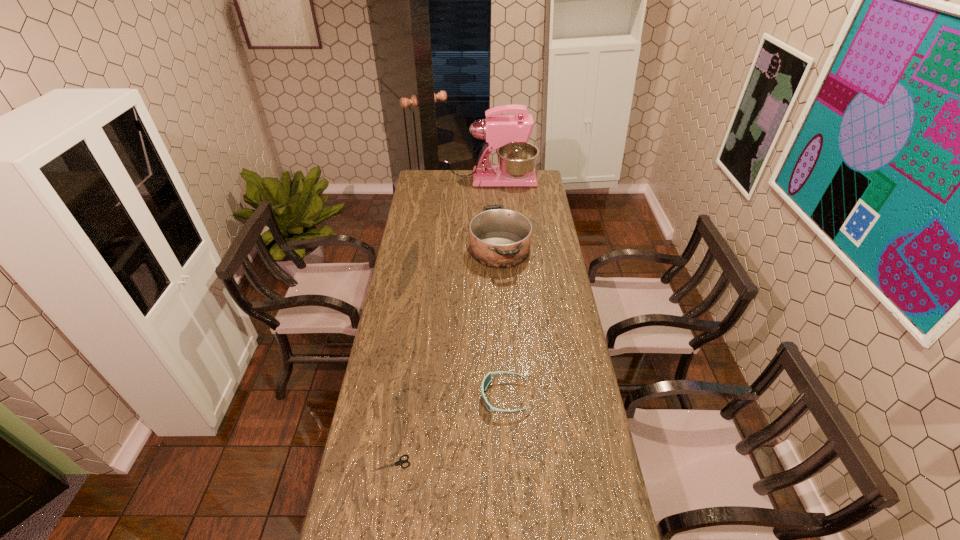
Identify the location of mixer. This screenshot has width=960, height=540. (507, 134).

At what (x,y) coordinates should I click in order to perform the action: click on the tallest object. Please return your answer as a coordinate pair (x, y). This screenshot has width=960, height=540. Looking at the image, I should click on (507, 134).

Where is `saucepan`? saucepan is located at coordinates (500, 238).

Where is `the second farthest object`? Image resolution: width=960 pixels, height=540 pixels. the second farthest object is located at coordinates (500, 238).

Identify the location of the third farthest object. (487, 379).

This screenshot has height=540, width=960. I want to click on the third tallest object, so click(x=487, y=379).

Image resolution: width=960 pixels, height=540 pixels. I want to click on shears, so click(x=400, y=462).

The image size is (960, 540). I want to click on the leftmost object, so click(400, 462).

Find the location of `vacant space situated on the face of the mixer`. vacant space situated on the face of the mixer is located at coordinates (545, 180).

This screenshot has height=540, width=960. I want to click on vacant space located 0.080m on the left of the third nearest object, so click(453, 249).